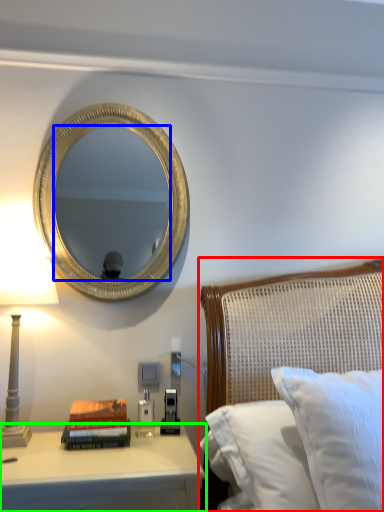
Question: Based on their relative distances, which object is farther from bed (highlighted by a red box)? Choose from mirror (highlighted by a blue box) and nightstand (highlighted by a green box).

Choices:
 (A) mirror
 (B) nightstand

Answer: (A)